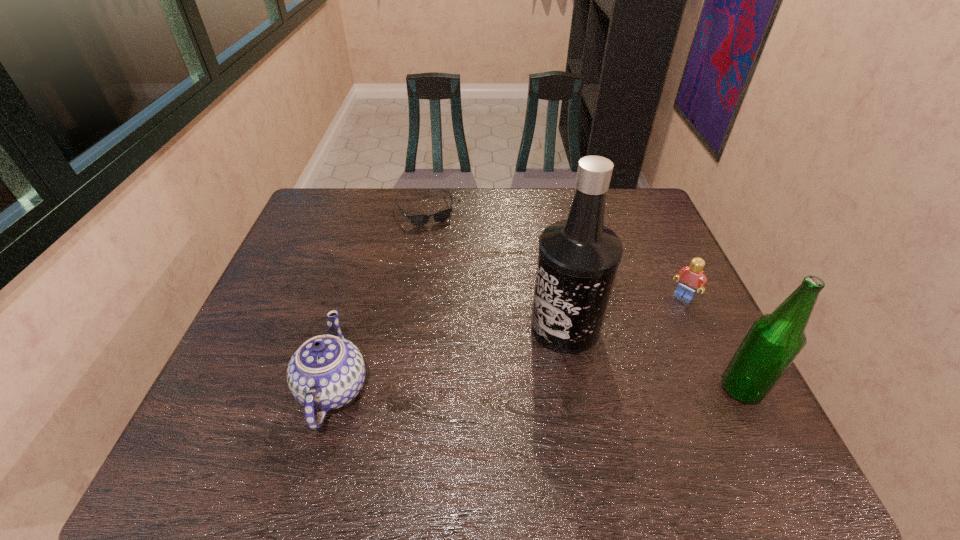
The height and width of the screenshot is (540, 960). In order to click on blank space located 0.300m on the front-facing side of the fourth tallest object in this screenshot , I will do `click(616, 369)`.

Where is `vacant area located on the front-facing side of the shortest object`? vacant area located on the front-facing side of the shortest object is located at coordinates (450, 273).

What are the coordinates of `free point located on the front-facing side of the shortest object` in the screenshot? It's located at (452, 279).

Where is `free spot located on the front-facing side of the shortest object`? The height and width of the screenshot is (540, 960). free spot located on the front-facing side of the shortest object is located at coordinates (464, 307).

The image size is (960, 540). In order to click on vacant space located 0.160m on the front label of the tallest object in this screenshot , I will do `click(509, 396)`.

Locate an element on the screen. This screenshot has height=540, width=960. vacant region located on the front label of the tallest object is located at coordinates (490, 419).

You are a GUI agent. You are given a task and a screenshot of the screen. Output one action in this format:
    pyautogui.click(x=<x>, y=<y>)
    Task: Click on the vacant space located 0.120m on the front label of the tallest object
    
    Given the screenshot: What is the action you would take?
    pyautogui.click(x=518, y=383)

The width and height of the screenshot is (960, 540). Identify the location of object present at the far edge. (419, 220).

Locate an element on the screen. chinaware at the near edge is located at coordinates (327, 371).

At what (x,y) coordinates should I click in order to perform the action: click on beer bottle situated at the near edge. Please return your answer as a coordinate pair (x, y). The height and width of the screenshot is (540, 960). Looking at the image, I should click on (773, 342).